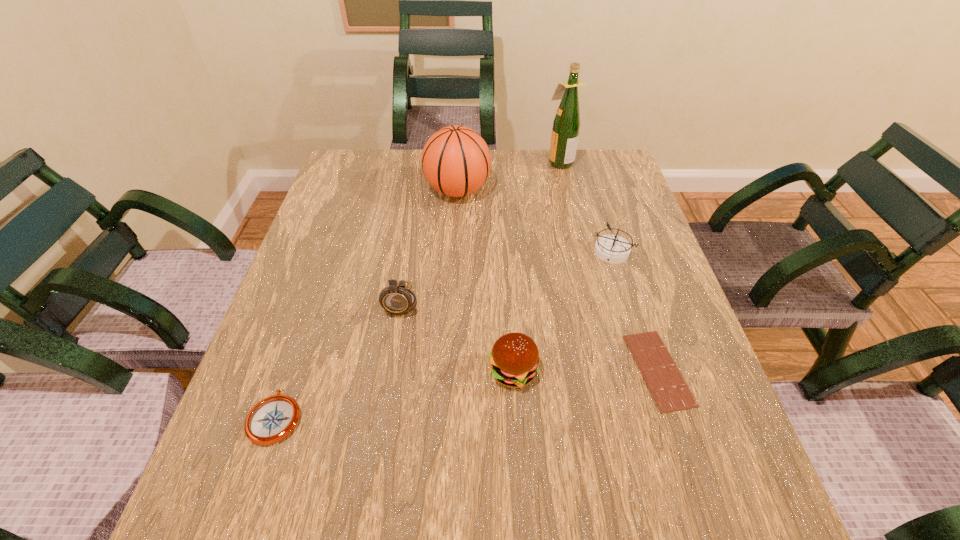
Identify the location of free location at the right edge of the desktop. (602, 201).

The width and height of the screenshot is (960, 540). I want to click on free spot at the far left corner of the desktop, so click(x=353, y=154).

Where is `free space at the near right corner`? The height and width of the screenshot is (540, 960). free space at the near right corner is located at coordinates (710, 504).

Identify the location of free space between the tallest object and the fourth tallest object. The width and height of the screenshot is (960, 540). (537, 266).

Find the location of a particular element. The height and width of the screenshot is (540, 960). vacant space that is in between the third tallest object and the tallest object is located at coordinates (480, 231).

This screenshot has width=960, height=540. I want to click on empty space between the shortest object and the third farthest object, so click(x=636, y=311).

Where is `vacant area between the chocolate bar and the fifth shortest object`? vacant area between the chocolate bar and the fifth shortest object is located at coordinates (530, 335).

Locate an element on the screen. The image size is (960, 540). vacant point located between the farthest compass and the second farthest compass is located at coordinates (507, 276).

The width and height of the screenshot is (960, 540). In order to click on empty space that is in between the fourth shortest object and the liquor in this screenshot , I will do `click(537, 266)`.

Identify the location of vacant area that lies between the third shortest object and the hamburger. This screenshot has height=540, width=960. (563, 312).